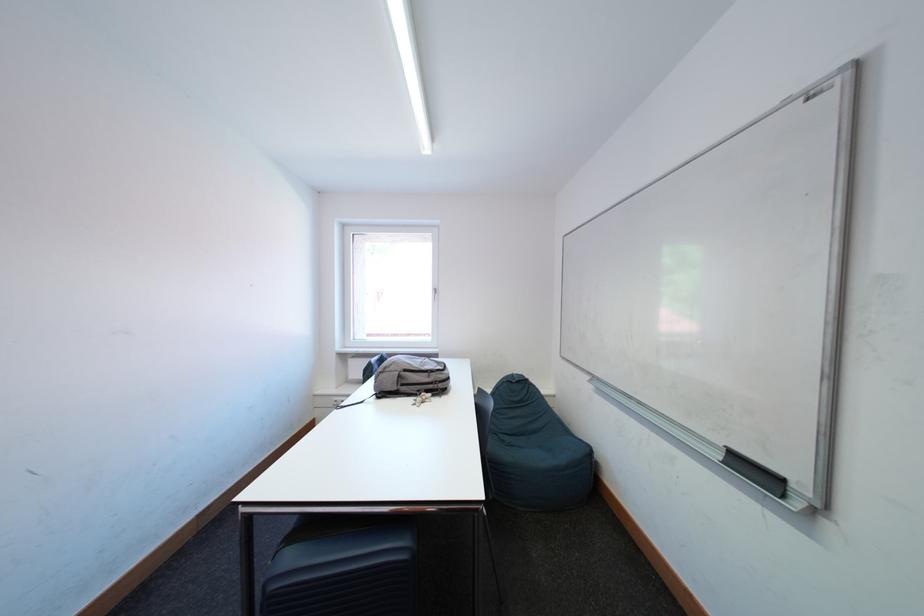
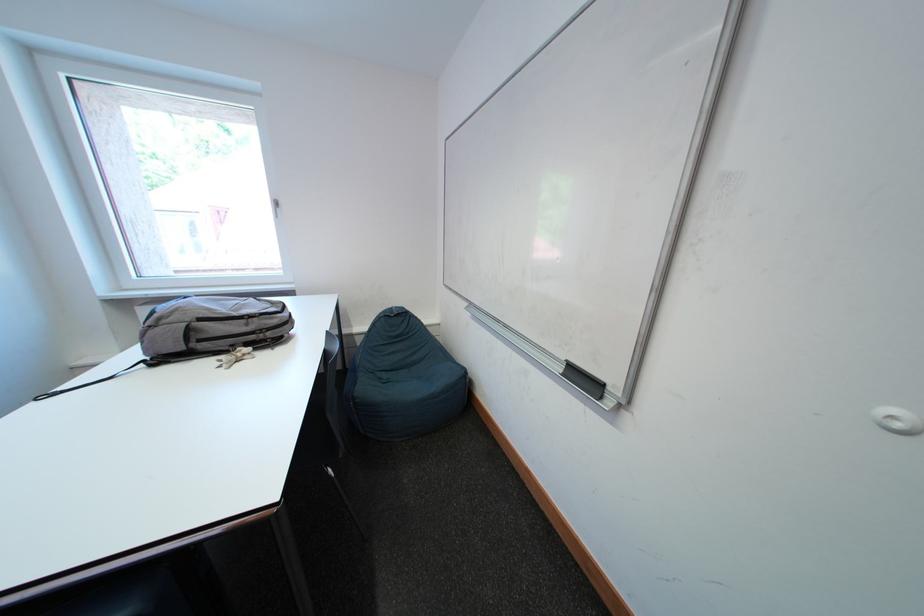
Find the pixel in the second image that matches point (428, 394) in the first image.

(241, 349)